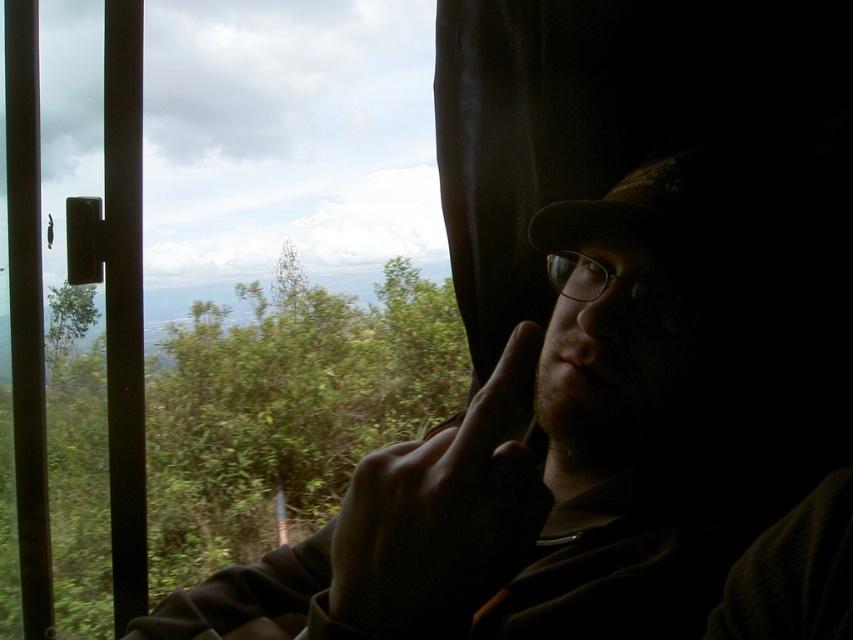
In the scene shown: You are a passenger on a train and see the transparent glass window at upper left and the dark skin finger at center. Which object is located to the left of the other?

The transparent glass window at upper left is positioned on the left side of dark skin finger at center.